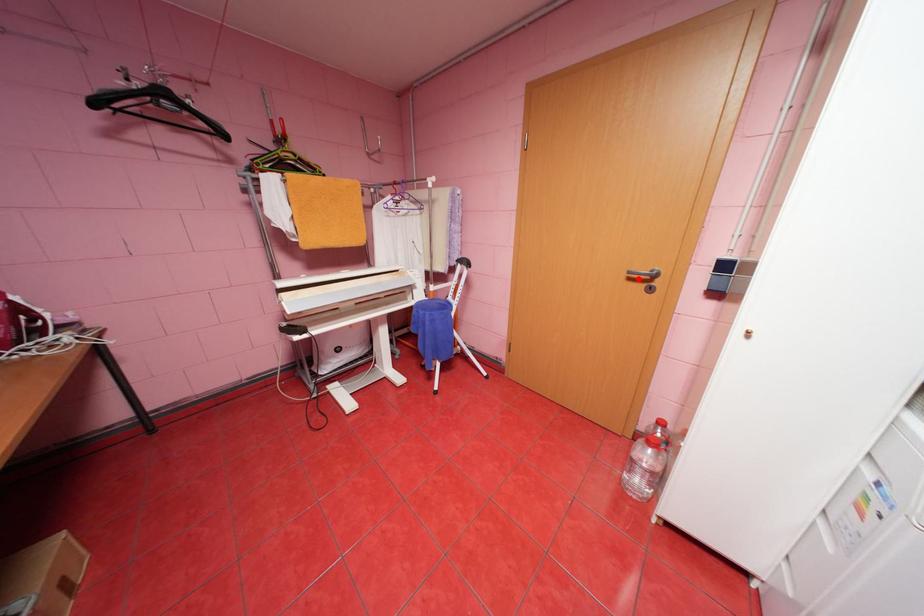
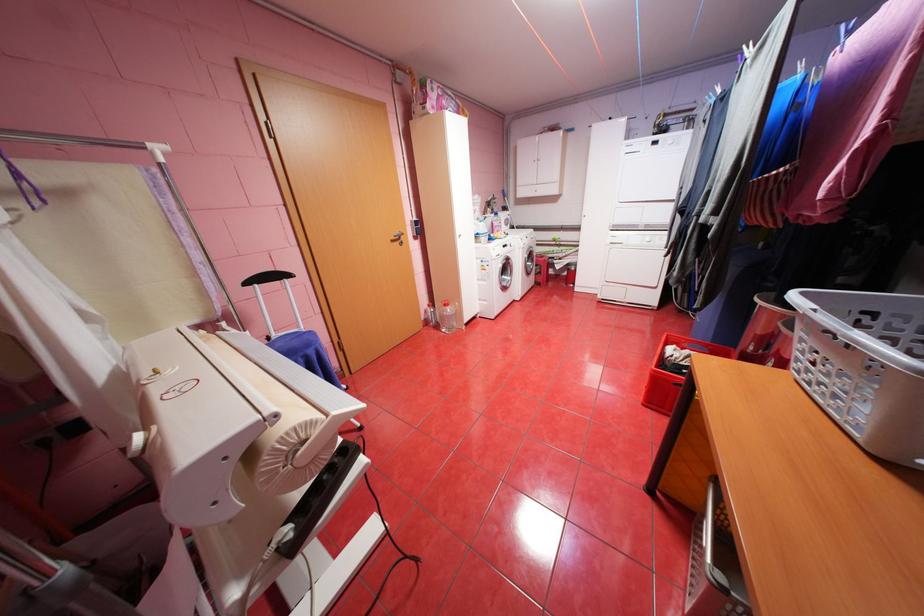
Question: I am providing you with two images of the same scene from different viewpoints. Given a red point in image1, look at the same physical point in image2. Is it:

Choices:
 (A) Closer to the viewpoint
 (B) Farther from the viewpoint

Answer: (A)